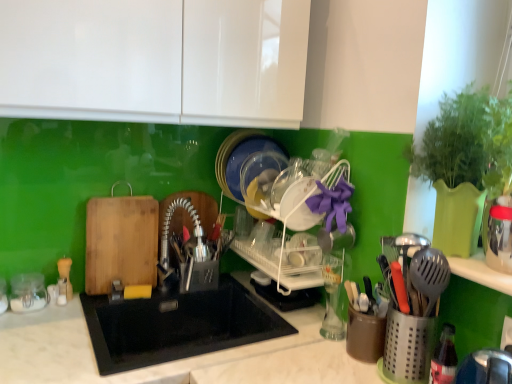
Question: From the image's perspective, is white plastic dish rack at center below clear glass jar at left?

Choices:
 (A) no
 (B) yes

Answer: (A)

Question: Is white plastic dish rack at center turned away from clear glass jar at left?

Choices:
 (A) no
 (B) yes

Answer: (A)

Question: From a real-world perspective, is white plastic dish rack at center beneath clear glass jar at left?

Choices:
 (A) no
 (B) yes

Answer: (A)

Question: Is white plastic dish rack at center at the right side of clear glass jar at left?

Choices:
 (A) no
 (B) yes

Answer: (B)

Question: Could you tell me if white plastic dish rack at center is turned towards clear glass jar at left?

Choices:
 (A) no
 (B) yes

Answer: (A)

Question: Is white plastic dish rack at center not within clear glass jar at left?

Choices:
 (A) no
 (B) yes

Answer: (B)

Question: From a real-world perspective, is black matte sink at center located beneath white plastic dish rack at center?

Choices:
 (A) no
 (B) yes

Answer: (B)

Question: Is white plastic dish rack at center inside black matte sink at center?

Choices:
 (A) no
 (B) yes

Answer: (A)

Question: Considering the relative sizes of black matte sink at center and white plastic dish rack at center in the image provided, is black matte sink at center smaller than white plastic dish rack at center?

Choices:
 (A) no
 (B) yes

Answer: (A)

Question: From the image's perspective, is black matte sink at center on top of white plastic dish rack at center?

Choices:
 (A) yes
 (B) no

Answer: (B)

Question: Is black matte sink at center next to white plastic dish rack at center and touching it?

Choices:
 (A) no
 (B) yes

Answer: (A)

Question: From the image's perspective, is black matte sink at center beneath white plastic dish rack at center?

Choices:
 (A) no
 (B) yes

Answer: (B)

Question: Is black matte sink at center taller than clear glass jar at left?

Choices:
 (A) no
 (B) yes

Answer: (B)